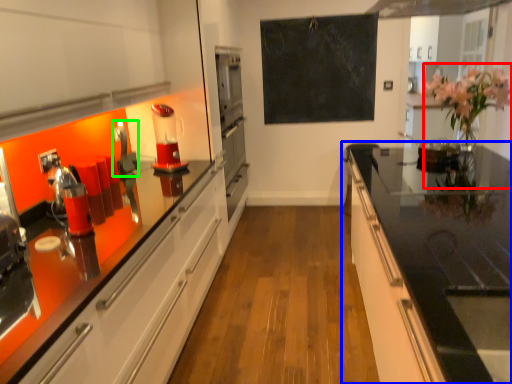
Question: Which is farther away from floral arrangement (highlighted by a red box)? countertop (highlighted by a blue box) or appliance (highlighted by a green box)?

Choices:
 (A) countertop
 (B) appliance

Answer: (B)